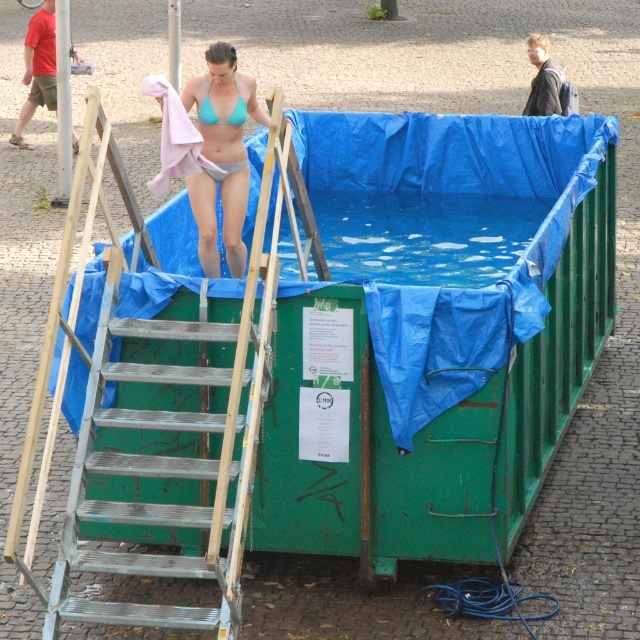
Does metallic silver ladder at left lie behind teal matte bikini top at upper center?

No, metallic silver ladder at left is closer to the viewer.

Is metallic silver ladder at left smaller than teal matte bikini top at upper center?

Incorrect, metallic silver ladder at left is not smaller in size than teal matte bikini top at upper center.

This screenshot has height=640, width=640. I want to click on metallic silver ladder at left, so click(x=182, y=422).

Measure the distance between point [200,252] and camera.

Point [200,252] and camera are 36.06 feet apart.

Can you confirm if teal matte bikini at center is positioned to the right of teal matte bikini top at upper center?

In fact, teal matte bikini at center is to the left of teal matte bikini top at upper center.

Which is in front, point (211, 198) or point (209, 100)?

Point (209, 100) is more forward.

You are a GUI agent. You are given a task and a screenshot of the screen. Output one action in this format:
    pyautogui.click(x=<x>, y=<y>)
    Task: Click on the teal matte bikini at center
    
    Given the screenshot: What is the action you would take?
    pyautogui.click(x=221, y=154)

Which of these two, metallic silver ladder at left or teal matte bikini at center, stands shorter?

teal matte bikini at center

Between point (250, 289) and point (202, 195), which one is positioned behind?

Point (202, 195)

Is point (244, 452) in front of point (227, 106)?

Yes.

Where is `metallic silver ladder at left`? The height and width of the screenshot is (640, 640). metallic silver ladder at left is located at coordinates (182, 422).